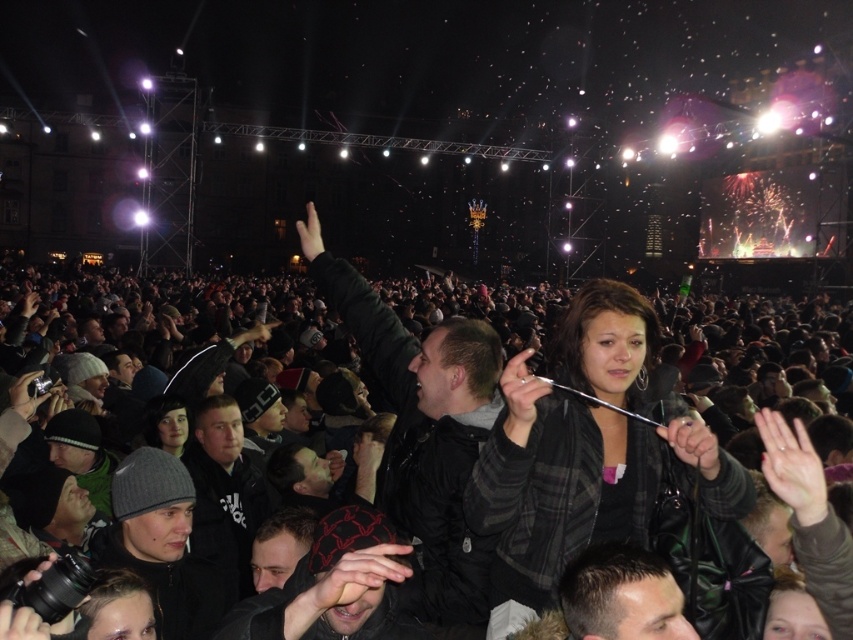
You are a photographer at the concert and want to capture the black leather jacket at center in your photo. What are the coordinates where you should focus your camera?

The black leather jacket at center is located at coordinates point (x=720, y=529), so you should focus your camera there.

You are a photographer trying to capture a wide shot of the crowd at the concert. You notice two jackets in the center of the image, a black leather jacket at center and a plaid fabric jacket at center. Which jacket takes up more horizontal space in the photo?

The black leather jacket at center takes up more horizontal space in the photo because its width surpasses that of the plaid fabric jacket at center.